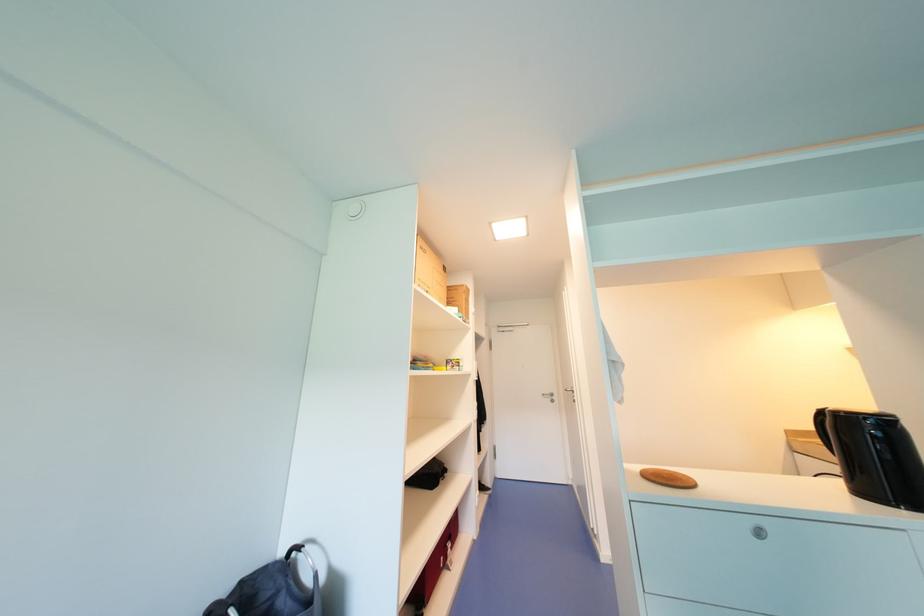
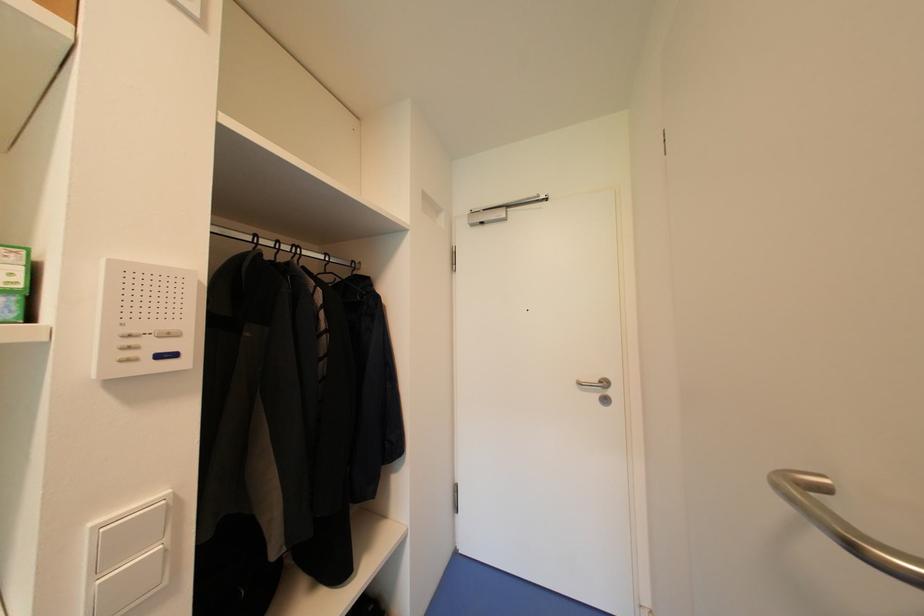
Question: In a continuous first-person perspective shot, in which direction is the camera moving?

Choices:
 (A) Left
 (B) Right
 (C) Forward
 (D) Backward

Answer: (C)